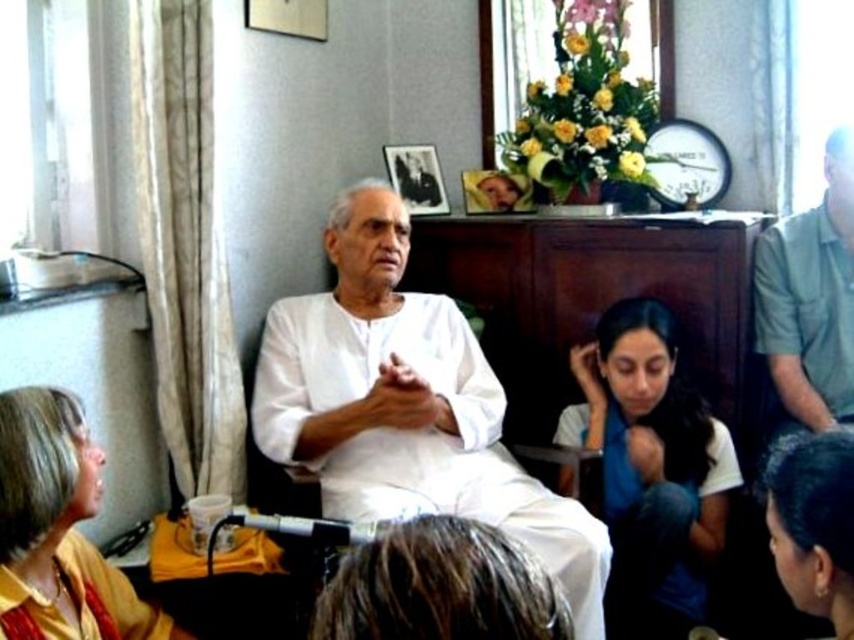
Based on the photo, between white cotton kurta at center and black hair at center, which one appears on the right side from the viewer's perspective?

From the viewer's perspective, black hair at center appears more on the right side.

The image size is (854, 640). I want to click on white cotton kurta at center, so click(407, 404).

Describe the element at coordinates (407, 404) in the screenshot. I see `white cotton kurta at center` at that location.

I want to click on white cotton kurta at center, so click(x=407, y=404).

Consider the image. Who is shorter, yellow fabric at lower left or black hair at center?

black hair at center is shorter.

Between yellow fabric at lower left and black hair at center, which one is positioned lower?

yellow fabric at lower left

I want to click on yellow fabric at lower left, so click(x=57, y=531).

Is white cotton shirt at lower center bigger than green fabric shirt at right?

Yes, white cotton shirt at lower center is bigger than green fabric shirt at right.

Which is above, white cotton shirt at lower center or green fabric shirt at right?

green fabric shirt at right is higher up.

The width and height of the screenshot is (854, 640). Identify the location of white cotton shirt at lower center. (652, 468).